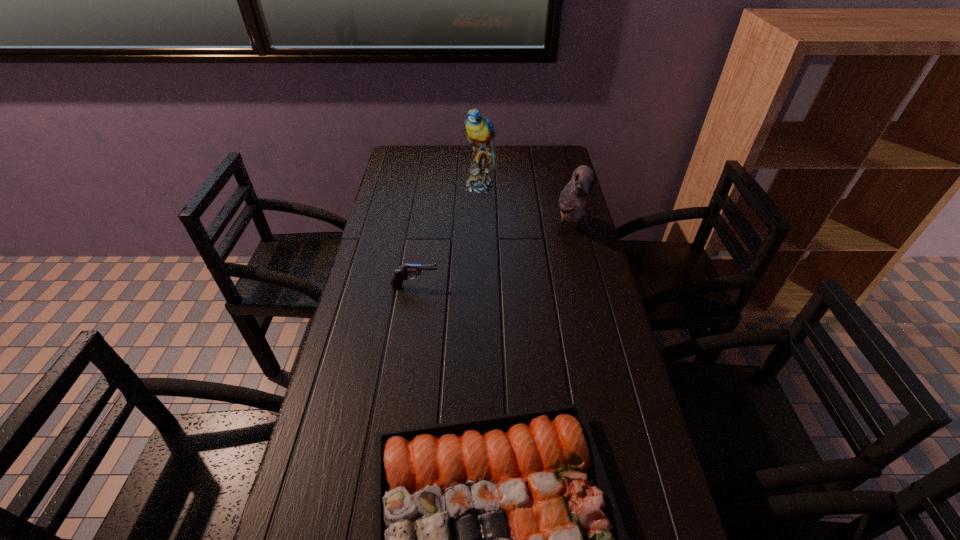
In order to click on object at the left edge in this screenshot , I will do `click(401, 274)`.

Where is `object at the right edge`? The image size is (960, 540). object at the right edge is located at coordinates click(x=576, y=198).

In the image, there is a desktop. At what (x,y) coordinates should I click in order to perform the action: click on vacant area at the far edge. Please return your answer as a coordinate pair (x, y). The width and height of the screenshot is (960, 540). Looking at the image, I should click on (495, 150).

The width and height of the screenshot is (960, 540). I want to click on vacant space at the left edge of the desktop, so click(391, 205).

Locate an element on the screen. This screenshot has width=960, height=540. free region at the right edge of the desktop is located at coordinates (599, 333).

You are a GUI agent. You are given a task and a screenshot of the screen. Output one action in this format:
    pyautogui.click(x=<x>, y=<y>)
    Task: Click on the free space at the far left corner of the desktop
    
    Given the screenshot: What is the action you would take?
    pyautogui.click(x=393, y=162)

Locate an element on the screen. Image resolution: width=960 pixels, height=540 pixels. free spot between the pistol and the shorter parrot is located at coordinates (492, 260).

In order to click on empty location between the farthest object and the pistol in this screenshot , I will do `click(447, 236)`.

I want to click on vacant space that's between the third tallest object and the farther parrot, so click(x=447, y=236).

Locate an element on the screen. This screenshot has width=960, height=540. free area in between the third tallest object and the nearer parrot is located at coordinates (492, 260).